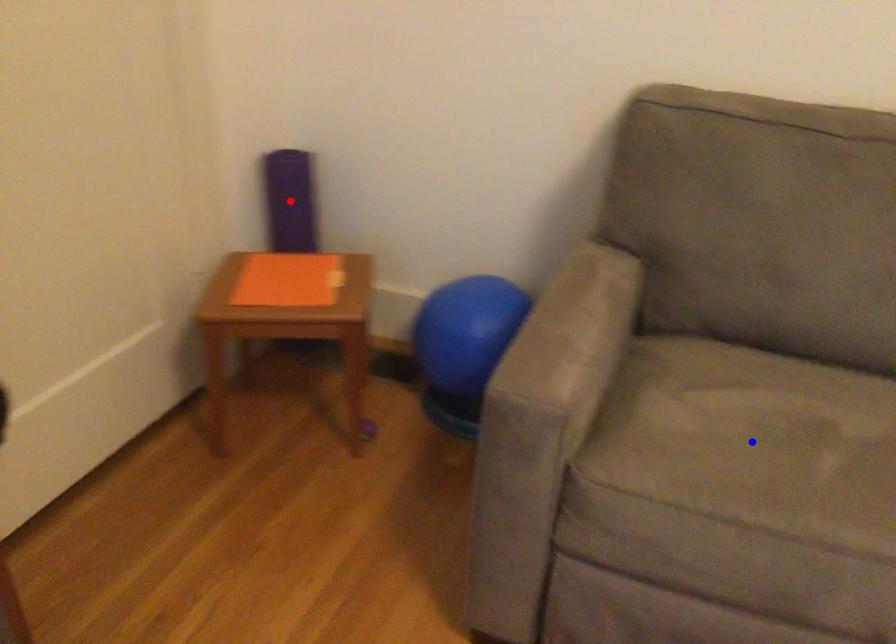
Question: In the image, two points are highlighted. Which point is nearer to the camera? Reply with the corresponding letter.

Choices:
 (A) blue point
 (B) red point

Answer: (A)